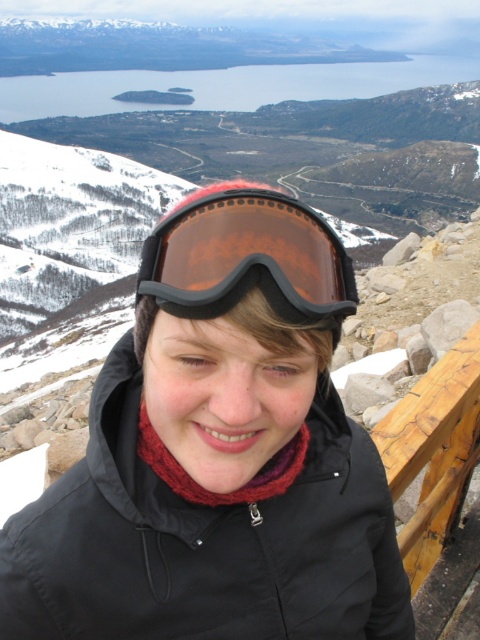
You are an outdoor enthusiast planning to carry both the transparent plastic goggles at center and the black fabric jacket at center in your backpack. If the jacket takes up more space, which item would you need to fold or compress first?

The transparent plastic goggles at center is smaller than the black fabric jacket at center, so you would need to fold or compress the black fabric jacket at center first since it takes up more space.

You are an adventurer who just arrived at a mountain viewpoint. You have a black fabric jacket at center and transparent plastic goggles at center. Which item is positioned to the right of the other?

The transparent plastic goggles at center are to the right of the black fabric jacket at center.